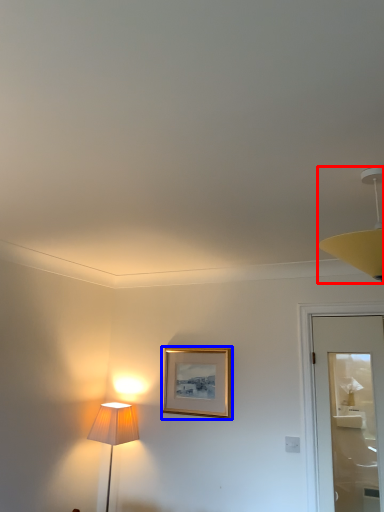
Question: Which object appears farthest to the camera in this image, lamp (highlighted by a red box) or picture frame (highlighted by a blue box)?

Choices:
 (A) lamp
 (B) picture frame

Answer: (B)